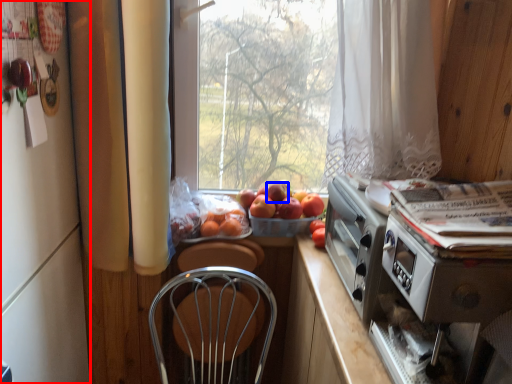
Question: Which point is closer to the camera, fridge (highlighted by a red box) or apple (highlighted by a blue box)?

Choices:
 (A) fridge
 (B) apple

Answer: (A)